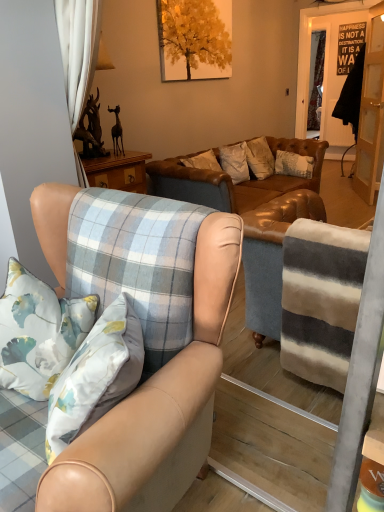
Question: Could light brown leather armchair at center be considered to be inside white floral pillow at left?

Choices:
 (A) yes
 (B) no

Answer: (B)

Question: Can you confirm if white floral pillow at left is positioned to the left of light brown leather armchair at center?

Choices:
 (A) yes
 (B) no

Answer: (A)

Question: From a real-world perspective, is white floral pillow at left on light brown leather armchair at center?

Choices:
 (A) yes
 (B) no

Answer: (A)

Question: Is white floral pillow at left not close to light brown leather armchair at center?

Choices:
 (A) no
 (B) yes

Answer: (A)

Question: Is white floral pillow at left positioned with its back to light brown leather armchair at center?

Choices:
 (A) no
 (B) yes

Answer: (B)

Question: Can you confirm if white floral pillow at left is shorter than light brown leather armchair at center?

Choices:
 (A) no
 (B) yes

Answer: (B)

Question: Can you confirm if leather couch at center is positioned to the right of clear glass door at right?

Choices:
 (A) no
 (B) yes

Answer: (A)

Question: Is leather couch at center positioned far away from clear glass door at right?

Choices:
 (A) no
 (B) yes

Answer: (B)

Question: From a real-world perspective, is leather couch at center on clear glass door at right?

Choices:
 (A) yes
 (B) no

Answer: (B)

Question: Does leather couch at center have a larger size compared to clear glass door at right?

Choices:
 (A) no
 (B) yes

Answer: (B)

Question: Can you confirm if leather couch at center is taller than clear glass door at right?

Choices:
 (A) no
 (B) yes

Answer: (A)

Question: Does leather couch at center have a lesser height compared to clear glass door at right?

Choices:
 (A) yes
 (B) no

Answer: (A)

Question: From the image's perspective, would you say white floral pillow at left is positioned over leather couch at center?

Choices:
 (A) yes
 (B) no

Answer: (B)